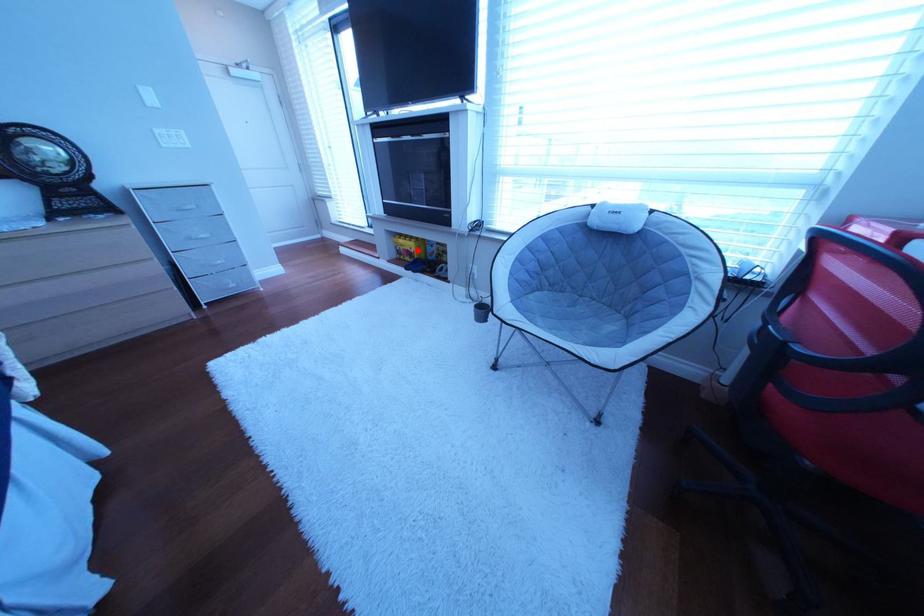
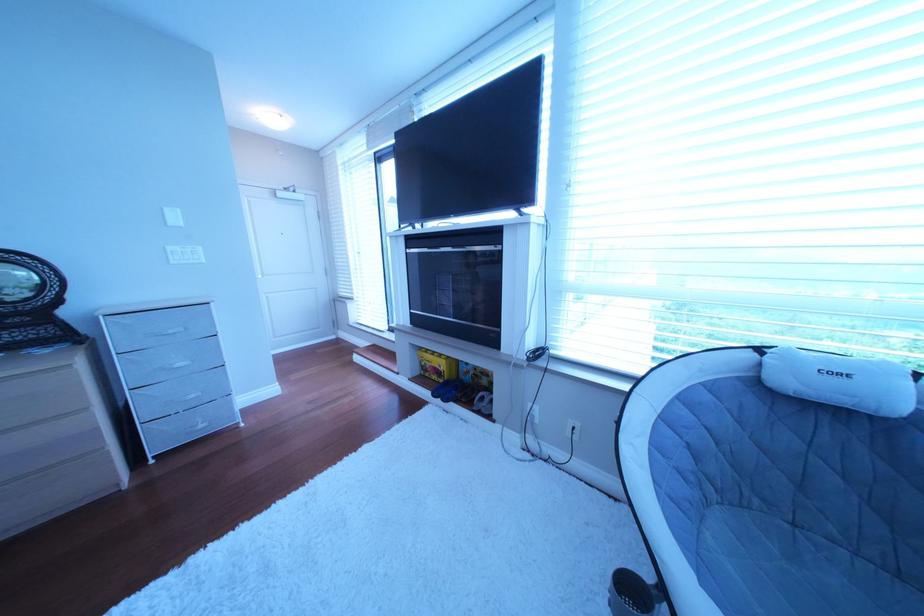
Find the pixel in the second image that matches the highlighted location in the first image.

(444, 367)